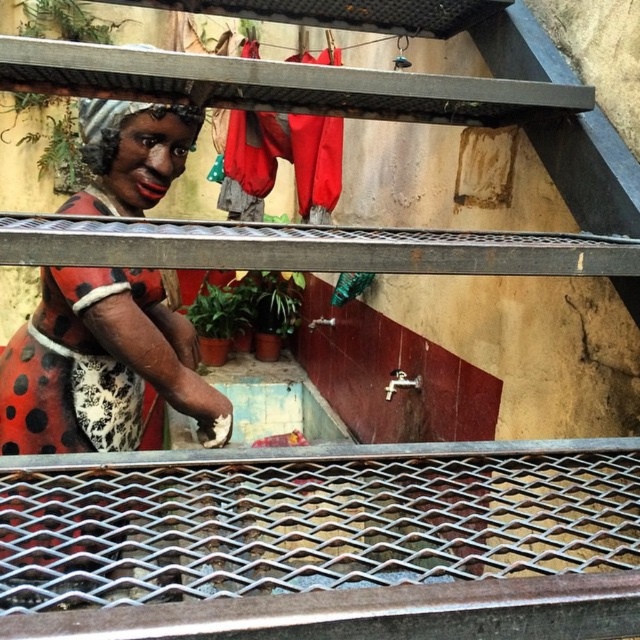
You are a delivery person trying to determine if you can see the red fabric laundry at upper center through the metallic grid at center. Based on their positions, can you see it?

The metallic grid at center is below red fabric laundry at upper center, so yes, you can see the red fabric laundry at upper center through the metallic grid at center because it is positioned above it.

You are standing 1.5 meters away from the fence. Can you reach the point at coordinates point (122, 164) without moving closer?

The distance of point (122, 164) from viewer is 1.70 meters. Since you are currently 1.5 meters away from the fence, you are closer than the required distance to reach the point. Therefore, you can reach the point at coordinates point (122, 164) without moving closer.

You are standing in front of the metal grated fence and see two points marked on the image. Which point is closer to you, point (122,192) or point (476,264)?

Point (122,192) is closer to you because it is further to the viewer than point (476,264).